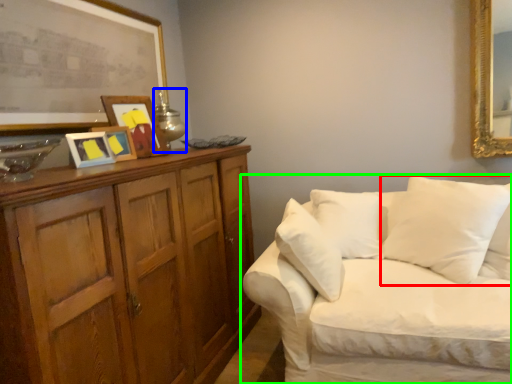
Question: Estimate the real-world distances between objects in this image. Which object is closer to pillow (highlighted by a red box), table lamp (highlighted by a blue box) or studio couch (highlighted by a green box)?

Choices:
 (A) table lamp
 (B) studio couch

Answer: (B)